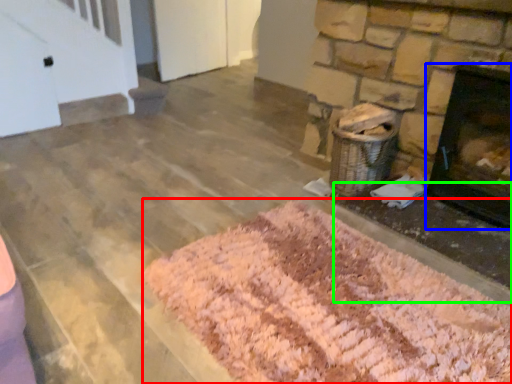
Question: Estimate the real-world distances between objects in this image. Which object is farther from mat (highlighted by a red box), fireplace (highlighted by a blue box) or foundation (highlighted by a green box)?

Choices:
 (A) fireplace
 (B) foundation

Answer: (A)